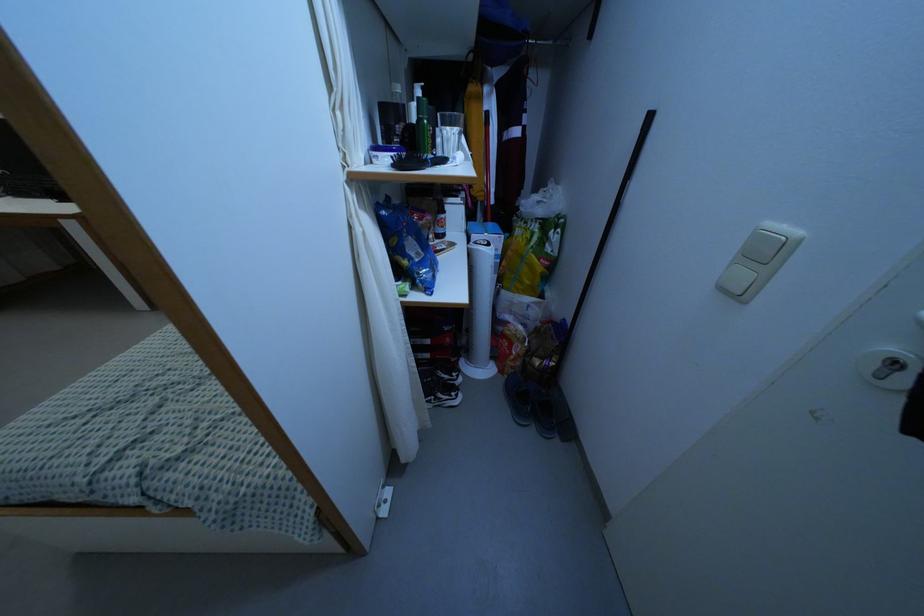
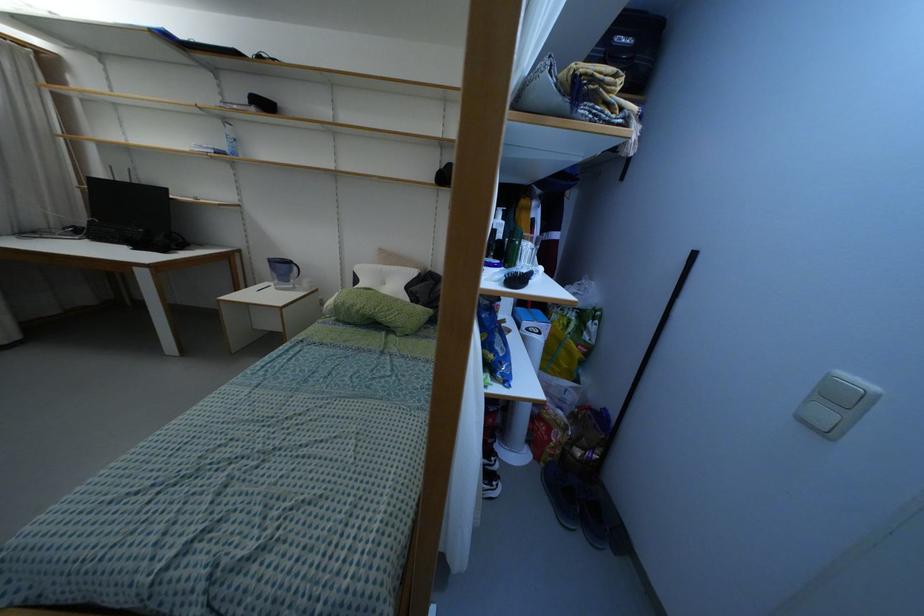
Question: In a continuous first-person perspective shot, in which direction is the camera moving?

Choices:
 (A) Left
 (B) Right
 (C) Forward
 (D) Backward

Answer: (A)